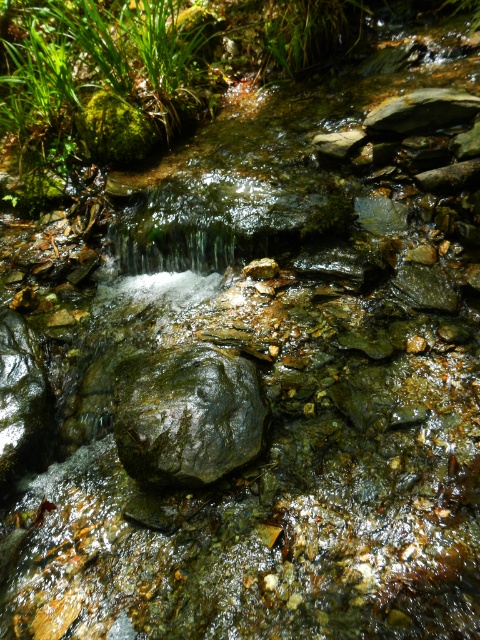
Question: Which point is closer to the camera?

Choices:
 (A) (205, 358)
 (B) (23, 424)

Answer: (A)

Question: Considering the relative positions of shiny dark rock at center and shiny dark rock at left in the image provided, where is shiny dark rock at center located with respect to shiny dark rock at left?

Choices:
 (A) above
 (B) below

Answer: (B)

Question: Among these objects, which one is farthest from the camera?

Choices:
 (A) shiny dark rock at center
 (B) shiny dark rock at left

Answer: (B)

Question: Can you confirm if shiny dark rock at center is positioned above shiny dark rock at left?

Choices:
 (A) yes
 (B) no

Answer: (B)

Question: Is shiny dark rock at center smaller than shiny dark rock at left?

Choices:
 (A) yes
 (B) no

Answer: (A)